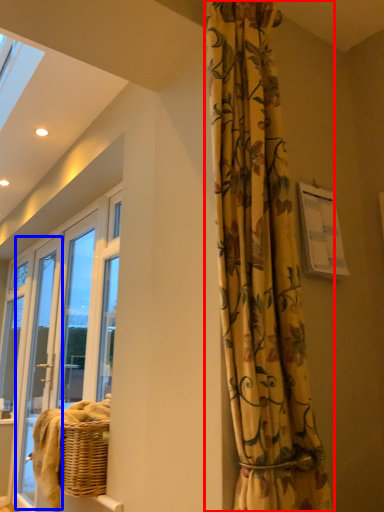
Question: Which of the following is the farthest to the observer, curtain (highlighted by a red box) or screen door (highlighted by a blue box)?

Choices:
 (A) curtain
 (B) screen door

Answer: (B)